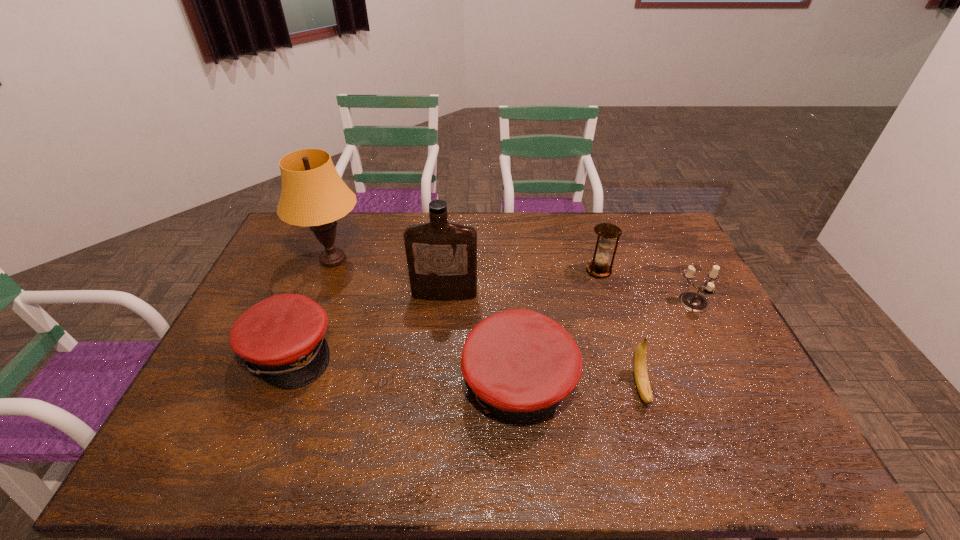
Find the location of `free point located on the front-facing side of the right cap`. free point located on the front-facing side of the right cap is located at coordinates (324, 384).

Identify the location of vacant space located on the back of the fifth shortest object. (583, 218).

You are a GUI agent. You are given a task and a screenshot of the screen. Output one action in this format:
    pyautogui.click(x=<x>, y=<y>)
    Task: Click on the vacant point located on the left of the lampshade
    The image size is (960, 540).
    Given the screenshot: What is the action you would take?
    pyautogui.click(x=277, y=260)

Find the location of a particular element. vacant area situated 0.330m on the left of the rightmost object is located at coordinates (571, 303).

You are a GUI agent. You are given a task and a screenshot of the screen. Output one action in this format:
    pyautogui.click(x=<x>, y=<y>)
    Task: Click on the vacant area located on the label side of the liquor
    
    Given the screenshot: What is the action you would take?
    pyautogui.click(x=442, y=325)

Locate an element on the screen. This screenshot has height=540, width=960. object that is at the far edge is located at coordinates (313, 194).

Locate an element on the screen. This screenshot has height=540, width=960. cap present at the near edge is located at coordinates (520, 364).

Where is `banana situated at the near edge`? banana situated at the near edge is located at coordinates (642, 382).

The image size is (960, 540). I want to click on cap that is at the left edge, so pos(282,338).

The width and height of the screenshot is (960, 540). Find the location of `lampshade that is at the left edge`. lampshade that is at the left edge is located at coordinates (313, 194).